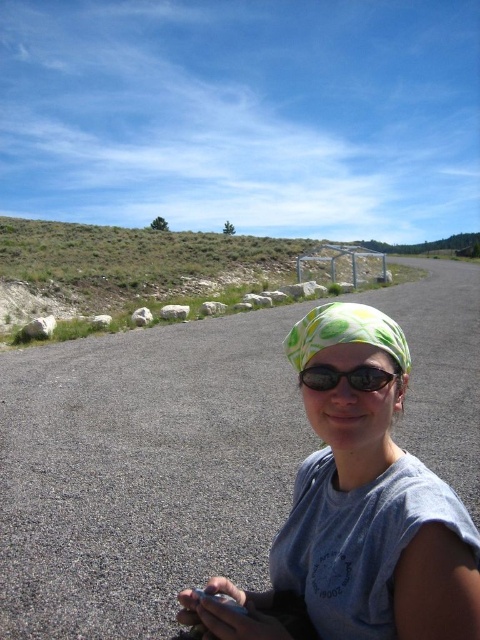
Question: Does light blue cotton shirt at center have a lesser width compared to printed fabric headscarf at center?

Choices:
 (A) no
 (B) yes

Answer: (B)

Question: Is printed fabric headscarf at center wider than matte black sunglasses at center?

Choices:
 (A) no
 (B) yes

Answer: (B)

Question: Which point appears closest to the camera in this image?

Choices:
 (A) (408, 349)
 (B) (312, 364)

Answer: (B)

Question: Does printed fabric headscarf at center have a smaller size compared to matte black sunglasses at center?

Choices:
 (A) no
 (B) yes

Answer: (A)

Question: Estimate the real-world distances between objects in this image. Which object is closer to the printed fabric headscarf at center?

Choices:
 (A) matte black sunglasses at center
 (B) light blue cotton shirt at center

Answer: (A)

Question: Which object is farther from the camera taking this photo?

Choices:
 (A) printed fabric headscarf at center
 (B) light blue cotton shirt at center

Answer: (A)